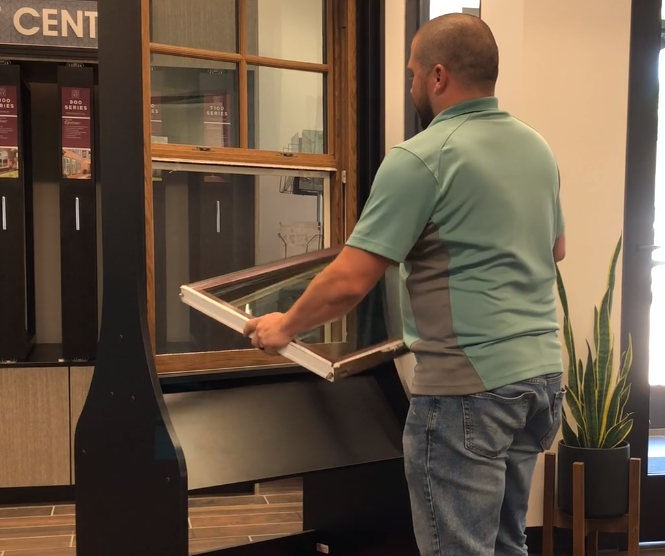
This screenshot has width=665, height=556. In order to click on glass in this screenshot , I will do `click(211, 248)`, `click(187, 91)`, `click(289, 34)`, `click(215, 31)`, `click(304, 99)`, `click(284, 289)`, `click(660, 342)`, `click(446, 4)`.